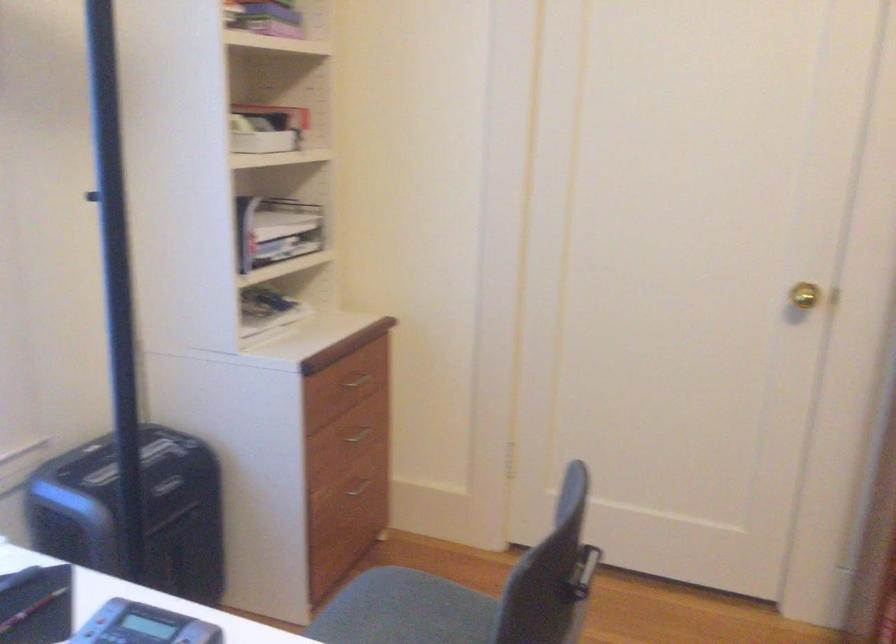
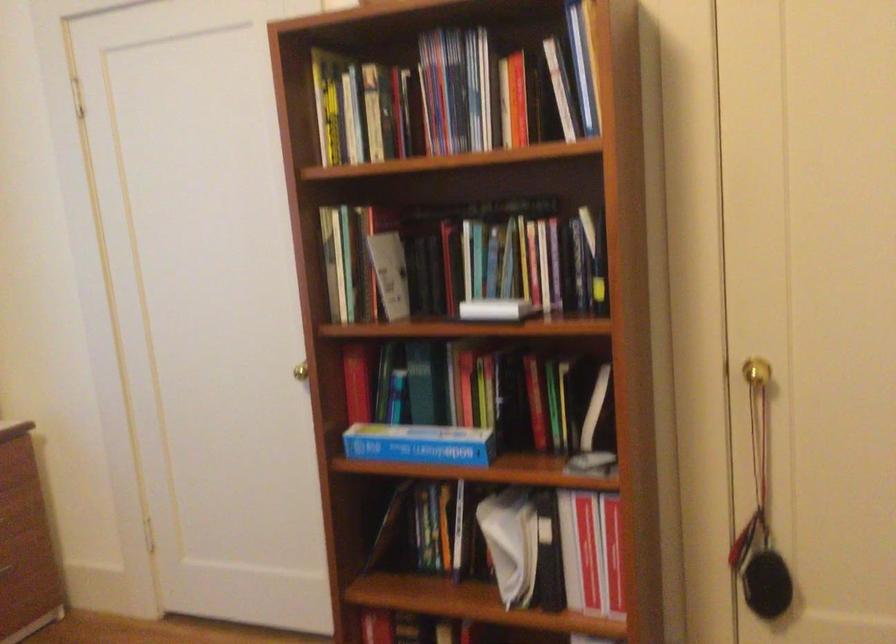
Question: In a continuous first-person perspective shot, in which direction is the camera moving?

Choices:
 (A) Left
 (B) Right
 (C) Forward
 (D) Backward

Answer: (B)